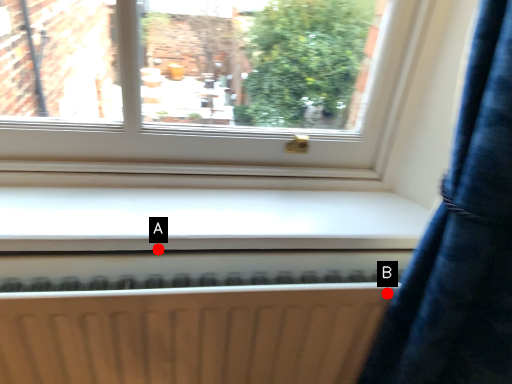
Question: Two points are circled on the image, labeled by A and B beside each circle. Which of the following is the closest to the observer?

Choices:
 (A) A is closer
 (B) B is closer

Answer: (B)